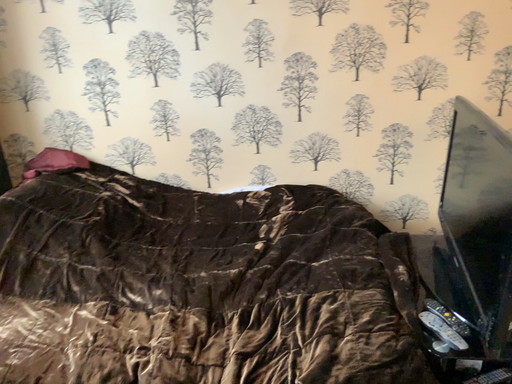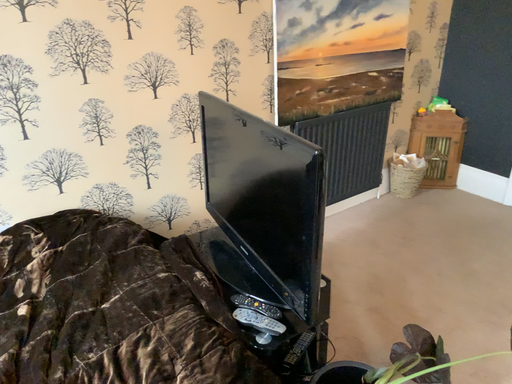
Question: How did the camera likely rotate when shooting the video?

Choices:
 (A) rotated right
 (B) rotated left

Answer: (A)